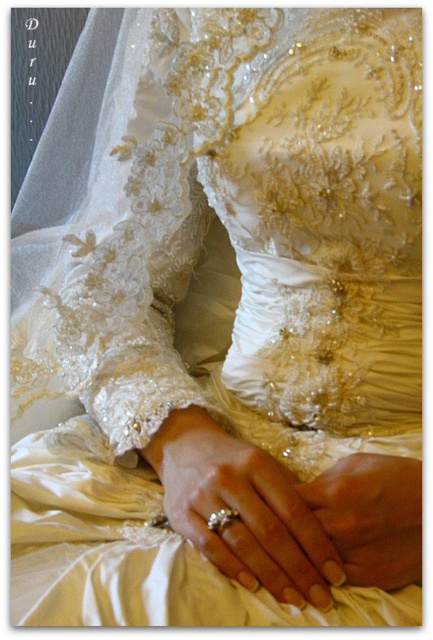
You are a photographer adjusting the lighting for a wedding dress photo shoot. You notice two points on the dress at coordinates point [277,570] and point [222,515]. Which point should you focus your light on to highlight the lace sleeve detail that is closer to the camera?

Point [277,570] should be focused on because it is in front of point [222,515], making it closer to the camera and thus the ideal spot to highlight the lace sleeve detail.

You are a jeweler who needs to measure the space between two rings on the person. The rings are the silver metallic ring at center and the gold shiny ring at center. Can you fit a third ring that is 2 inches wide between them?

The distance between the silver metallic ring at center and the gold shiny ring at center is 2.21 inches. Since the third ring is 2 inches wide, there is enough space to fit it between them as 2.21 inches is greater than 2 inches.